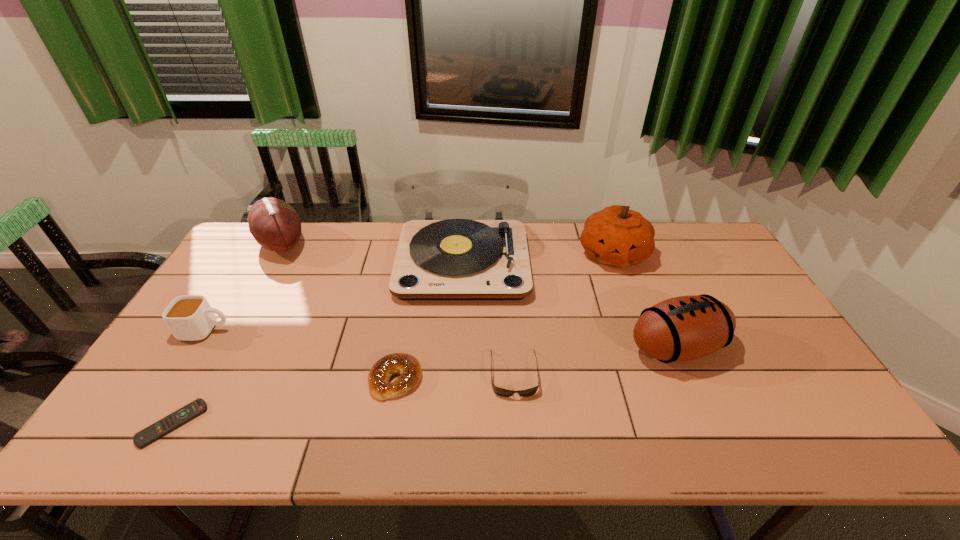
The image size is (960, 540). Identify the location of vacant region between the bagel and the pumpkin. (504, 316).

Identify the location of vacant area between the bagel and the fourth shortest object. (301, 355).

I want to click on unoccupied position between the cup and the record player, so click(335, 295).

The image size is (960, 540). What are the coordinates of `free point between the nearer football (American) and the bagel` in the screenshot? It's located at (536, 363).

The height and width of the screenshot is (540, 960). In order to click on vacant area that lies between the bagel and the left football (American) in this screenshot , I will do `click(339, 312)`.

You are a GUI agent. You are given a task and a screenshot of the screen. Output one action in this format:
    pyautogui.click(x=<x>, y=<y>)
    Task: Click on the vacant space that is in between the farther football (American) and the cup
    This screenshot has height=540, width=960.
    Given the screenshot: What is the action you would take?
    pyautogui.click(x=244, y=287)

Locate an element on the screen. This screenshot has width=960, height=540. vacant space that is in between the bagel and the nearer football (American) is located at coordinates coord(536,363).

Where is `unoccupied position between the bagel and the left football (American)`? The image size is (960, 540). unoccupied position between the bagel and the left football (American) is located at coordinates (339, 312).

Locate an element on the screen. vacant area that lies between the cup and the sunglasses is located at coordinates (360, 352).

This screenshot has height=540, width=960. What are the coordinates of `free point between the nearer football (American) and the tallest object` in the screenshot? It's located at (569, 304).